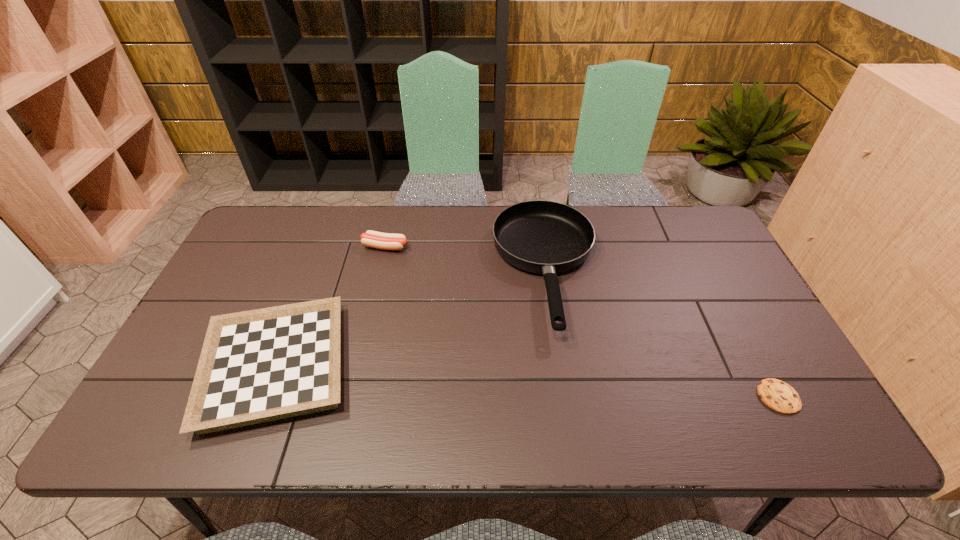
The height and width of the screenshot is (540, 960). I want to click on frying pan that is at the far edge, so click(x=544, y=237).

At what (x,y) coordinates should I click in order to perform the action: click on sausage at the far edge. Please return your answer as a coordinate pair (x, y). The image size is (960, 540). Looking at the image, I should click on (387, 241).

Locate an element on the screen. The image size is (960, 540). checkerboard that is positioned at the near edge is located at coordinates (267, 364).

Identify the location of cookie present at the near edge. Image resolution: width=960 pixels, height=540 pixels. pos(779,396).

Where is `object that is at the left edge`? object that is at the left edge is located at coordinates (267, 364).

You are a GUI agent. You are given a task and a screenshot of the screen. Output one action in this format:
    pyautogui.click(x=<x>, y=<y>)
    Task: Click on the object that is at the right edge
    
    Given the screenshot: What is the action you would take?
    (x=779, y=396)

The image size is (960, 540). Find the location of `object at the near left corner`. object at the near left corner is located at coordinates click(267, 364).

The image size is (960, 540). I want to click on object at the near right corner, so click(779, 396).

Find the location of a particular element. Image resolution: width=960 pixels, height=540 pixels. blank area at the far edge is located at coordinates (422, 248).

Where is `free space at the near edge`? free space at the near edge is located at coordinates (411, 434).